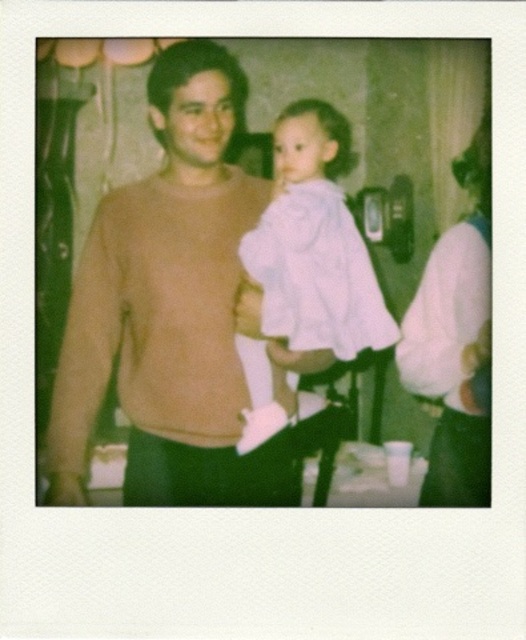
Does white soft fabric dress at center have a greater height compared to white fabric dress at right?

No.

Which is above, white soft fabric dress at center or white fabric dress at right?

white fabric dress at right is higher up.

Who is more forward, (270,257) or (404,337)?

Point (270,257) is in front.

You are a GUI agent. You are given a task and a screenshot of the screen. Output one action in this format:
    pyautogui.click(x=<x>, y=<y>)
    Task: Click on the white soft fabric dress at center
    This screenshot has width=526, height=640.
    Given the screenshot: What is the action you would take?
    pyautogui.click(x=313, y=248)

Which is behind, point (154, 200) or point (289, 189)?

Positioned behind is point (154, 200).

Is brown sweater at center wider than white soft fabric dress at center?

Indeed, brown sweater at center has a greater width compared to white soft fabric dress at center.

Is point (235, 216) farther from viewer compared to point (346, 308)?

That is True.

You are a GUI agent. You are given a task and a screenshot of the screen. Output one action in this format:
    pyautogui.click(x=<x>, y=<y>)
    Task: Click on the brown sweater at center
    
    Given the screenshot: What is the action you would take?
    pyautogui.click(x=171, y=308)

Which is behind, point (156, 380) or point (484, 241)?

Positioned behind is point (484, 241).

Does brown sweater at center have a greater height compared to white fabric dress at right?

Incorrect, brown sweater at center's height is not larger of white fabric dress at right's.

Who is more distant from viewer, (x=88, y=289) or (x=461, y=493)?

Positioned behind is point (x=461, y=493).

In order to click on brown sweater at center in this screenshot , I will do `click(171, 308)`.